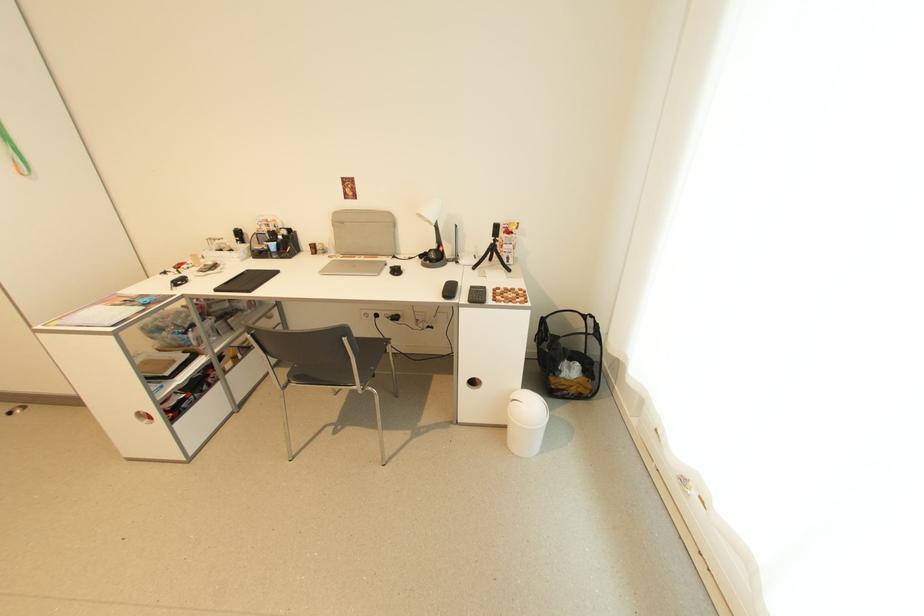
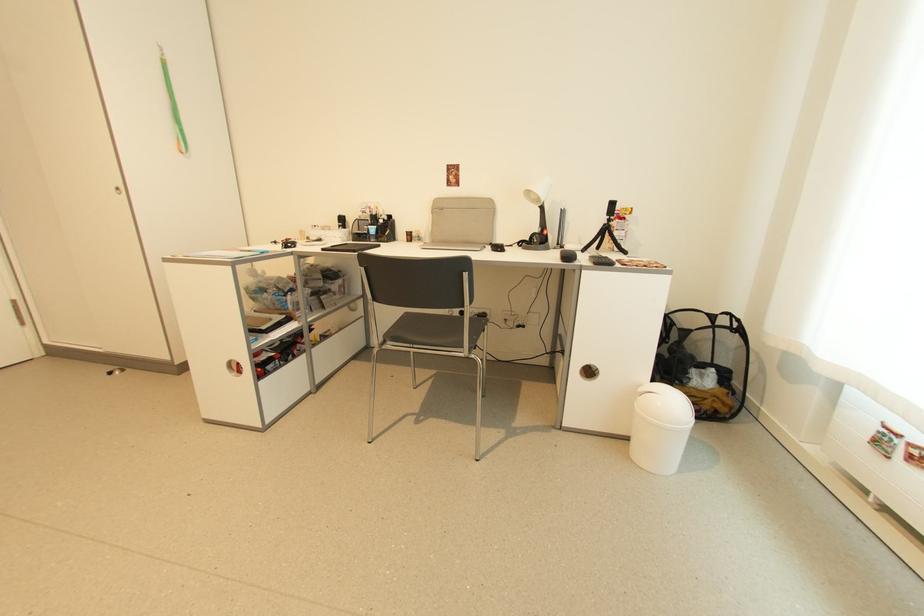
Locate, in the second image, the point that corresponds to point 529,410 in the first image.

(664, 405)